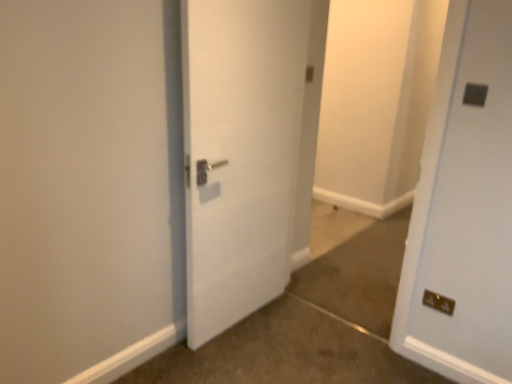
This screenshot has width=512, height=384. Identify the location of unoccupied region to the right of white matte door at center. (313, 337).